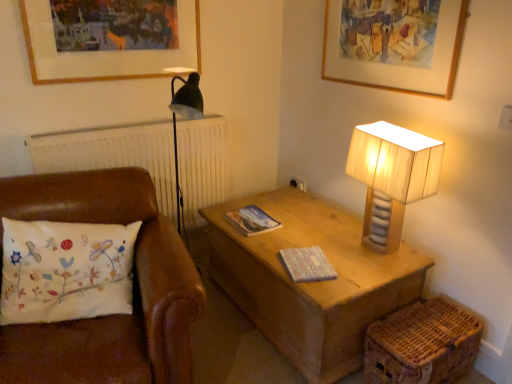
The width and height of the screenshot is (512, 384). Describe the element at coordinates (393, 173) in the screenshot. I see `wooden lampshade at right` at that location.

What do you see at coordinates (252, 220) in the screenshot? I see `matte paper magazine at center, which is the first magazine from back to front` at bounding box center [252, 220].

Identify the location of wooden picture frame at upper left, which appears as the 1th picture frame when viewed from the left. (104, 51).

Is wooden picture frame at upper center, the second picture frame positioned from the left, taller than white embroidered pillow at left?

Incorrect, the height of wooden picture frame at upper center, the second picture frame positioned from the left, is not larger of that of white embroidered pillow at left.

From a real-world perspective, between wooden picture frame at upper center, the second picture frame positioned from the left, and white embroidered pillow at left, who is vertically higher?

wooden picture frame at upper center, the second picture frame positioned from the left.

Which point is more distant from viewer, (431, 87) or (188, 286)?

The point (431, 87) is farther.

Is wooden picture frame at upper center, the second picture frame positioned from the left, far from white embroidered pillow at left?

Yes, wooden picture frame at upper center, the second picture frame positioned from the left, and white embroidered pillow at left are located far from each other.

From the image's perspective, is white embroidered pillow at left located beneath wooden picture frame at upper left, which appears as the 1th picture frame when viewed from the left?

Yes, from the image's perspective, white embroidered pillow at left is beneath wooden picture frame at upper left, which appears as the 1th picture frame when viewed from the left.

Can you confirm if white embroidered pillow at left is bigger than wooden picture frame at upper left, which appears as the 1th picture frame when viewed from the left?

Yes.

Is point (94, 185) closer or farther from the camera than point (133, 75)?

Point (94, 185).

Is wooden picture frame at upper left, which appears as the second picture frame when viewed from the right, at the back of white embroidered pillow at left?

No, wooden picture frame at upper left, which appears as the second picture frame when viewed from the right, is not at the back of white embroidered pillow at left.

Which object is wider, matte paper magazine at center, the 2th magazine in the right-to-left sequence, or wooden lampshade at right?

wooden lampshade at right is wider.

Would you say matte paper magazine at center, which is the second magazine from front to back, contains wooden lampshade at right?

Definitely not — wooden lampshade at right is not inside matte paper magazine at center, which is the second magazine from front to back.

There is a wooden lampshade at right. Find the location of `the 1st magazine below it (from the image's perspective)`. the 1st magazine below it (from the image's perspective) is located at coordinates (252, 220).

Is point (292, 255) positioned behind point (84, 193)?

Yes, it is behind point (84, 193).

Based on the photo, is wooden textured book at center, which ranks as the first magazine in front-to-back order, facing towards white embroidered pillow at left?

Yes, wooden textured book at center, which ranks as the first magazine in front-to-back order, is facing white embroidered pillow at left.

Is wooden textured book at center, placed as the first magazine when sorted from bottom to top, placed right next to white embroidered pillow at left?

No, wooden textured book at center, placed as the first magazine when sorted from bottom to top, is not next to white embroidered pillow at left.

Which is behind, wooden textured book at center, which ranks as the first magazine in front-to-back order, or white embroidered pillow at left?

wooden textured book at center, which ranks as the first magazine in front-to-back order, is more distant.

Is wooden lampshade at right positioned beyond the bounds of matte paper magazine at center, which is the first magazine from back to front?

Indeed, wooden lampshade at right is completely outside matte paper magazine at center, which is the first magazine from back to front.

Find the location of a particular element. The width and height of the screenshot is (512, 384). the 2nd magazine behind the wooden lampshade at right is located at coordinates (252, 220).

Can you confirm if wooden lampshade at right is shorter than matte paper magazine at center, which is the second magazine from front to back?

In fact, wooden lampshade at right may be taller than matte paper magazine at center, which is the second magazine from front to back.

From the image's perspective, is wooden lampshade at right on top of matte paper magazine at center, the 1th magazine from the left?

Yes.

From the picture: Is woven brown basket at lower right next to wooden picture frame at upper left, which appears as the 1th picture frame when viewed from the left?

No, woven brown basket at lower right is not touching wooden picture frame at upper left, which appears as the 1th picture frame when viewed from the left.

Is woven brown basket at lower right to the left of wooden picture frame at upper left, which appears as the second picture frame when viewed from the right, from the viewer's perspective?

No, woven brown basket at lower right is not to the left of wooden picture frame at upper left, which appears as the second picture frame when viewed from the right.

The height and width of the screenshot is (384, 512). Identify the location of picture frame that is the 2nd object located behind the woven brown basket at lower right. (104, 51).

Is woven brown basket at lower right positioned before wooden picture frame at upper left, which appears as the second picture frame when viewed from the right?

That is True.

Based on the photo, considering the relative sizes of wooden picture frame at upper left, which appears as the 1th picture frame when viewed from the left, and wooden textured book at center, which is counted as the 2th magazine, starting from the back, in the image provided, is wooden picture frame at upper left, which appears as the 1th picture frame when viewed from the left, wider than wooden textured book at center, which is counted as the 2th magazine, starting from the back,?

No, wooden picture frame at upper left, which appears as the 1th picture frame when viewed from the left, is not wider than wooden textured book at center, which is counted as the 2th magazine, starting from the back.

Is wooden picture frame at upper left, which appears as the second picture frame when viewed from the right, located outside wooden textured book at center, arranged as the 2th magazine when viewed from the left?

Indeed, wooden picture frame at upper left, which appears as the second picture frame when viewed from the right, is completely outside wooden textured book at center, arranged as the 2th magazine when viewed from the left.

From the image's perspective, which object appears higher, wooden picture frame at upper left, which appears as the second picture frame when viewed from the right, or wooden textured book at center, the second magazine positioned from the top?

wooden picture frame at upper left, which appears as the second picture frame when viewed from the right, from the image's perspective.

Is point (191, 5) positioned after point (330, 275)?

Yes, it is.

Where is `the 1st picture frame positioned above the white embroidered pillow at left (from the image's perspective)`? The image size is (512, 384). the 1st picture frame positioned above the white embroidered pillow at left (from the image's perspective) is located at coordinates (400, 65).

Identify the location of the 1st picture frame counting from the right of the white embroidered pillow at left. tap(104, 51).

Consider the image. Which object lies nearer to the anchor point matte paper magazine at center, which ranks as the second magazine in bottom-to-top order, wooden textured book at center, which ranks as the first magazine in front-to-back order, or wooden lampshade at right?

Based on the image, wooden textured book at center, which ranks as the first magazine in front-to-back order, appears to be nearer to matte paper magazine at center, which ranks as the second magazine in bottom-to-top order.

Based on their spatial positions, is matte paper magazine at center, arranged as the 1th magazine when viewed from the top, or wooden textured book at center, arranged as the first magazine when viewed from the right, closer to wooden picture frame at upper center, marked as the first picture frame in a right-to-left arrangement?

wooden textured book at center, arranged as the first magazine when viewed from the right, is positioned closer to the anchor wooden picture frame at upper center, marked as the first picture frame in a right-to-left arrangement.

When comparing their distances from woven brown basket at lower right, does wooden picture frame at upper center, marked as the first picture frame in a right-to-left arrangement, or matte paper magazine at center, the 2th magazine in the right-to-left sequence, seem further?

wooden picture frame at upper center, marked as the first picture frame in a right-to-left arrangement, lies further to woven brown basket at lower right than the other object.

Which object lies further to the anchor point wooden textured book at center, which ranks as the first magazine in front-to-back order, wooden picture frame at upper left, which appears as the 1th picture frame when viewed from the left, or woven brown basket at lower right?

wooden picture frame at upper left, which appears as the 1th picture frame when viewed from the left, is further to wooden textured book at center, which ranks as the first magazine in front-to-back order.

Looking at this image, estimate the real-world distances between objects in this image. Which object is closer to matte paper magazine at center, which is the first magazine from back to front, wooden lampshade at right or wooden picture frame at upper left, which appears as the 1th picture frame when viewed from the left?

wooden lampshade at right is positioned closer to the anchor matte paper magazine at center, which is the first magazine from back to front.

Considering their positions, is white embroidered pillow at left positioned closer to woven brown basket at lower right than wooden lampshade at right?

The object closer to woven brown basket at lower right is wooden lampshade at right.

From the image, which object appears to be farther from wooden lampshade at right, woven brown basket at lower right or matte paper magazine at center, which is the first magazine from back to front?

matte paper magazine at center, which is the first magazine from back to front, is positioned further to the anchor wooden lampshade at right.

Based on the photo, estimate the real-world distances between objects in this image. Which object is further from matte paper magazine at center, which ranks as the second magazine in bottom-to-top order, wooden lampshade at right or wooden textured book at center, placed as the first magazine when sorted from bottom to top?

wooden lampshade at right is positioned further to the anchor matte paper magazine at center, which ranks as the second magazine in bottom-to-top order.

I want to click on picture frame located between wooden picture frame at upper left, which appears as the second picture frame when viewed from the right, and wooden lampshade at right in the left-right direction, so pos(400,65).

The image size is (512, 384). I want to click on magazine that lies between wooden picture frame at upper center, marked as the first picture frame in a right-to-left arrangement, and wooden textured book at center, arranged as the first magazine when viewed from the right, from top to bottom, so click(252, 220).

At what (x,y) coordinates should I click in order to perform the action: click on lamp situated between wooden picture frame at upper left, which appears as the second picture frame when viewed from the right, and woven brown basket at lower right from left to right. Please return your answer as a coordinate pair (x, y). The width and height of the screenshot is (512, 384). Looking at the image, I should click on (393, 173).

Image resolution: width=512 pixels, height=384 pixels. I want to click on magazine located between matte paper magazine at center, which is the second magazine from front to back, and wooden lampshade at right in the left-right direction, so click(x=307, y=264).